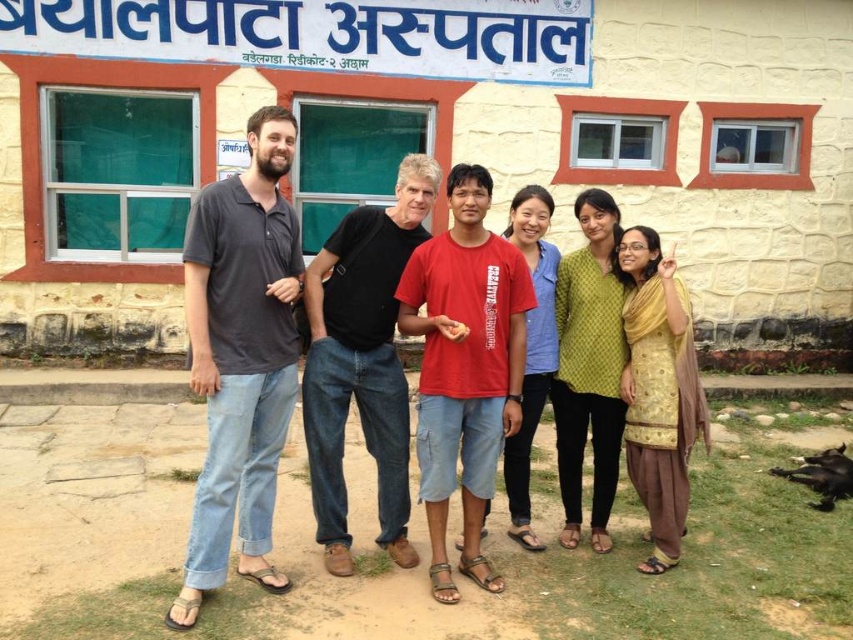
Question: Is red cotton t-shirt at center bigger than black cotton shirt at center?

Choices:
 (A) no
 (B) yes

Answer: (A)

Question: Which point is closer to the camera taking this photo?

Choices:
 (A) (646, 406)
 (B) (477, 333)
 (C) (397, 426)
 (D) (195, 365)

Answer: (D)

Question: Can you confirm if red cotton t-shirt at center is smaller than black cotton shirt at center?

Choices:
 (A) yes
 (B) no

Answer: (A)

Question: Which object is closer to the camera taking this photo?

Choices:
 (A) red cotton t-shirt at center
 (B) matte gray shirt at center

Answer: (B)

Question: Is matte gray shirt at center to the left of red cotton t-shirt at center from the viewer's perspective?

Choices:
 (A) no
 (B) yes

Answer: (B)

Question: Which of these objects is positioned farthest from the gray cotton polo shirt at left?

Choices:
 (A) matte gray shirt at center
 (B) yellow embroidered dress at center

Answer: (B)